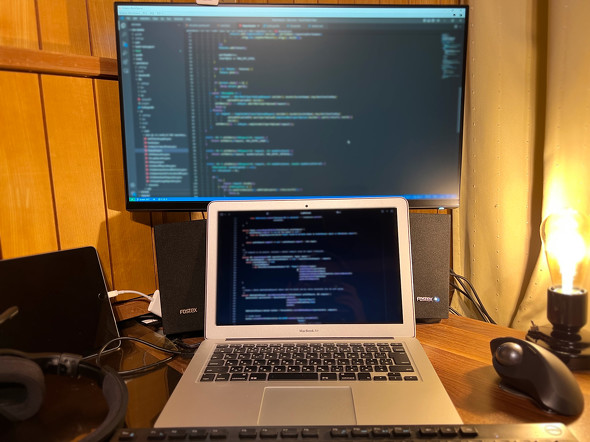
This screenshot has width=590, height=442. Find the location of `monitor`. monitor is located at coordinates (287, 66).